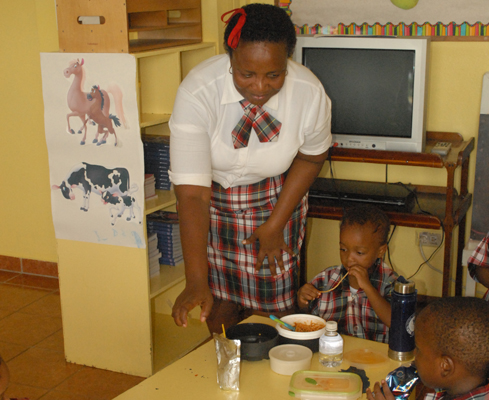
The image size is (489, 400). Identify the location of electrical cords. (413, 275), (423, 246).